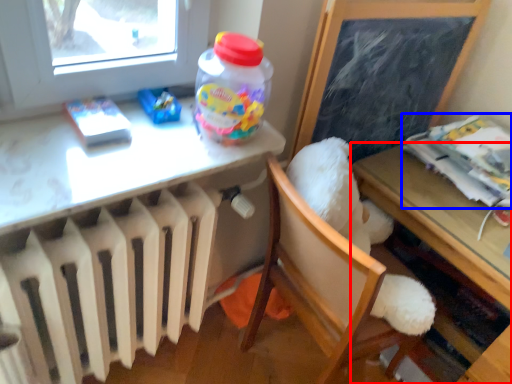
Question: Which of the following is the closest to the observer, table (highlighted by a red box) or magazine (highlighted by a blue box)?

Choices:
 (A) table
 (B) magazine

Answer: (A)